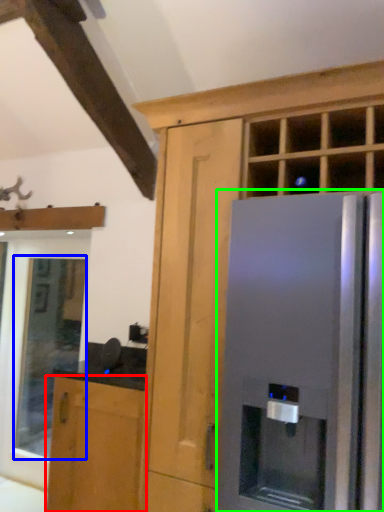
Question: Which is farther away from cabinetry (highlighted by a red box)? window (highlighted by a blue box) or refrigerator (highlighted by a green box)?

Choices:
 (A) window
 (B) refrigerator

Answer: (A)